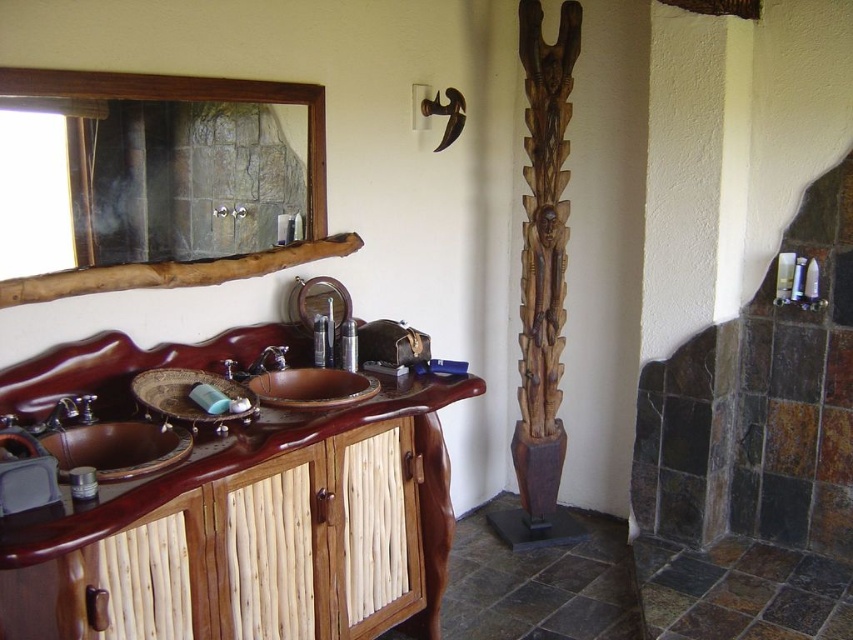
From the picture: Can you confirm if brown wood vanity at center is positioned to the right of brushed metal faucet at left?

Correct, you'll find brown wood vanity at center to the right of brushed metal faucet at left.

Which is behind, point (357, 513) or point (49, 416)?

Positioned behind is point (357, 513).

Find the location of a particular element. The width and height of the screenshot is (853, 640). brown wood vanity at center is located at coordinates [x=253, y=532].

Who is positioned more to the right, brown wooden bowl at center or brushed metal faucet at center?

Positioned to the right is brown wooden bowl at center.

Is brown wooden bowl at center positioned before brushed metal faucet at center?

Yes, it is in front of brushed metal faucet at center.

Is point (309, 369) farther from camera compared to point (282, 346)?

No.

Find the location of `brown wooden bowl at center`. brown wooden bowl at center is located at coordinates (312, 387).

Does point (20, 84) come in front of point (115, 444)?

That is True.

Identify the location of wooden frame mirror at upper left. The image size is (853, 640). (190, 99).